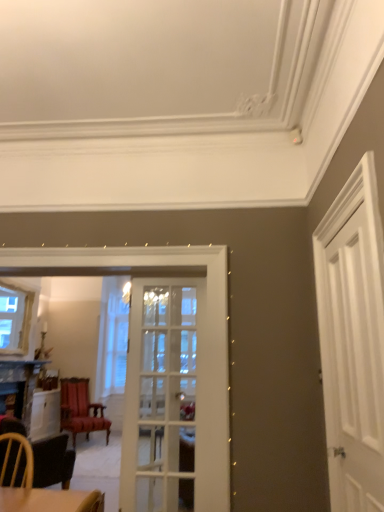
Question: Considering their positions, is velvet red chair at center located in front of or behind white wooden door at right, which is counted as the 1th door, starting from the right?

Choices:
 (A) behind
 (B) front

Answer: (A)

Question: From the image's perspective, is velvet red chair at center above or below white wooden door at right, placed as the 1th door when sorted from front to back?

Choices:
 (A) below
 (B) above

Answer: (A)

Question: Which object is the farthest from the white glass door at center, the 2th door when ordered from front to back?

Choices:
 (A) white wooden door at right, placed as the 1th door when sorted from front to back
 (B) velvet red chair at center
 (C) clear glass window at left

Answer: (B)

Question: Which of these objects is positioned closest to the white glass door at center, the 2th door when ordered from front to back?

Choices:
 (A) white wooden door at right, placed as the 1th door when sorted from front to back
 (B) clear glass window at left
 (C) velvet red chair at center

Answer: (A)